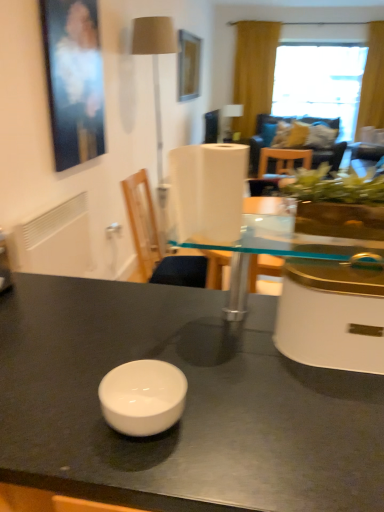
Question: Is white plastic chair at center next to transparent glass table at center?

Choices:
 (A) yes
 (B) no

Answer: (B)

Question: Is white plastic chair at center to the right of transparent glass table at center from the viewer's perspective?

Choices:
 (A) no
 (B) yes

Answer: (A)

Question: From a real-world perspective, does white plastic chair at center stand above transparent glass table at center?

Choices:
 (A) yes
 (B) no

Answer: (B)

Question: Is white plastic chair at center to the left of transparent glass table at center from the viewer's perspective?

Choices:
 (A) yes
 (B) no

Answer: (A)

Question: Does white plastic chair at center come behind transparent glass table at center?

Choices:
 (A) no
 (B) yes

Answer: (B)

Question: Is beige fabric lampshade at upper left to the left or to the right of white plastic chair at center in the image?

Choices:
 (A) left
 (B) right

Answer: (A)

Question: Considering the positions of point coord(162,200) and point coord(180,265), is point coord(162,200) closer or farther from the camera than point coord(180,265)?

Choices:
 (A) farther
 (B) closer

Answer: (A)

Question: Choose the correct answer: Is beige fabric lampshade at upper left inside white plastic chair at center or outside it?

Choices:
 (A) inside
 (B) outside

Answer: (B)

Question: From a real-world perspective, is beige fabric lampshade at upper left positioned above or below white plastic chair at center?

Choices:
 (A) below
 (B) above

Answer: (B)

Question: From the image's perspective, relative to beige fabric lampshade at upper left, is white glossy bowl at center above or below?

Choices:
 (A) above
 (B) below

Answer: (B)

Question: Would you say white glossy bowl at center is inside or outside beige fabric lampshade at upper left?

Choices:
 (A) outside
 (B) inside

Answer: (A)

Question: From a real-world perspective, is white glossy bowl at center physically located above or below beige fabric lampshade at upper left?

Choices:
 (A) below
 (B) above

Answer: (A)

Question: Relative to beige fabric lampshade at upper left, is white glossy bowl at center in front or behind?

Choices:
 (A) behind
 (B) front

Answer: (B)

Question: Considering the positions of transparent glass window at upper right and white glossy bowl at center in the image, is transparent glass window at upper right taller or shorter than white glossy bowl at center?

Choices:
 (A) tall
 (B) short

Answer: (A)

Question: From a real-world perspective, is transparent glass window at upper right physically located above or below white glossy bowl at center?

Choices:
 (A) below
 (B) above

Answer: (B)